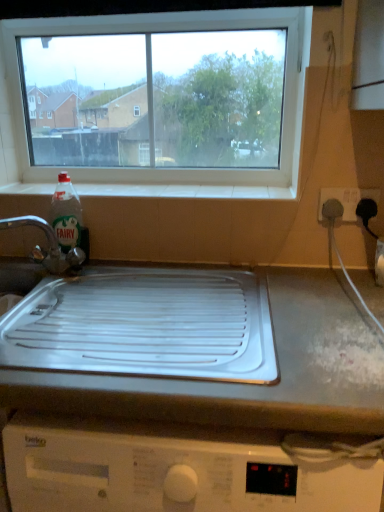
Locate an element on the screen. Image resolution: width=384 pixels, height=512 pixels. vacant point above transparent glass window at upper center (from a real-world perspective) is located at coordinates point(144,8).